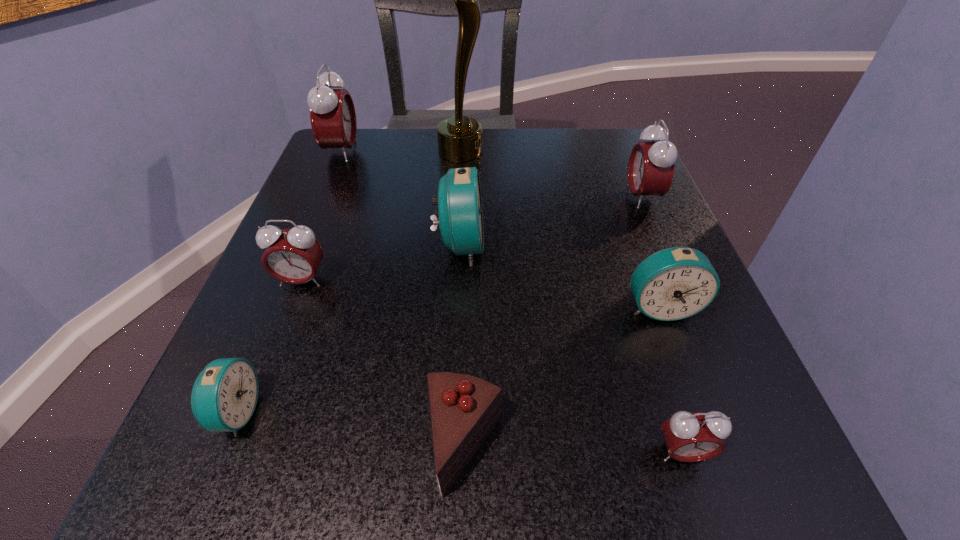
At what (x,y) coordinates should I click in order to perform the action: click on free point between the third nearest pink alarm clock and the nearest blue alarm clock. Please return your answer as a coordinate pair (x, y). The width and height of the screenshot is (960, 540). Looking at the image, I should click on (439, 305).

You are a GUI agent. You are given a task and a screenshot of the screen. Output one action in this format:
    pyautogui.click(x=<x>, y=<y>)
    Task: Click on the vacant space in between the chocolate cake and the leftmost blue alarm clock
    The height and width of the screenshot is (540, 960).
    Given the screenshot: What is the action you would take?
    pyautogui.click(x=350, y=429)

Identify the location of vacant point located between the award and the farthest pink alarm clock. (401, 151).

The width and height of the screenshot is (960, 540). What are the coordinates of `vacant point located between the farthest alarm clock and the chocolate cake` in the screenshot? It's located at (403, 298).

The width and height of the screenshot is (960, 540). What are the coordinates of `free point between the second farthest alarm clock and the nearest pink alarm clock` in the screenshot? It's located at (661, 325).

Where is `free space between the second smallest pink alarm clock and the tallest object`? Image resolution: width=960 pixels, height=540 pixels. free space between the second smallest pink alarm clock and the tallest object is located at coordinates (381, 215).

Locate an element on the screen. This screenshot has width=960, height=540. vacant space that's between the fourth alarm clock from right to left and the smallest blue alarm clock is located at coordinates (348, 329).

You are a GUI agent. You are given a task and a screenshot of the screen. Output one action in this format:
    pyautogui.click(x=<x>, y=<y>)
    Task: Click on the object that ranks as the fourth closest to the chocolate cake
    
    Given the screenshot: What is the action you would take?
    coord(675,283)

Choose which object is the nearest neighbor to the chocolate cake. Please provide its 2D coordinates. Your answer should be formatted as a tuple, i.e. [(x, y)], where the tuple contains the x and y coordinates of a point satisfying the conditions above.

[(689, 437)]

Image resolution: width=960 pixels, height=540 pixels. I want to click on alarm clock that is the second closest to the chocolate cake, so click(224, 396).